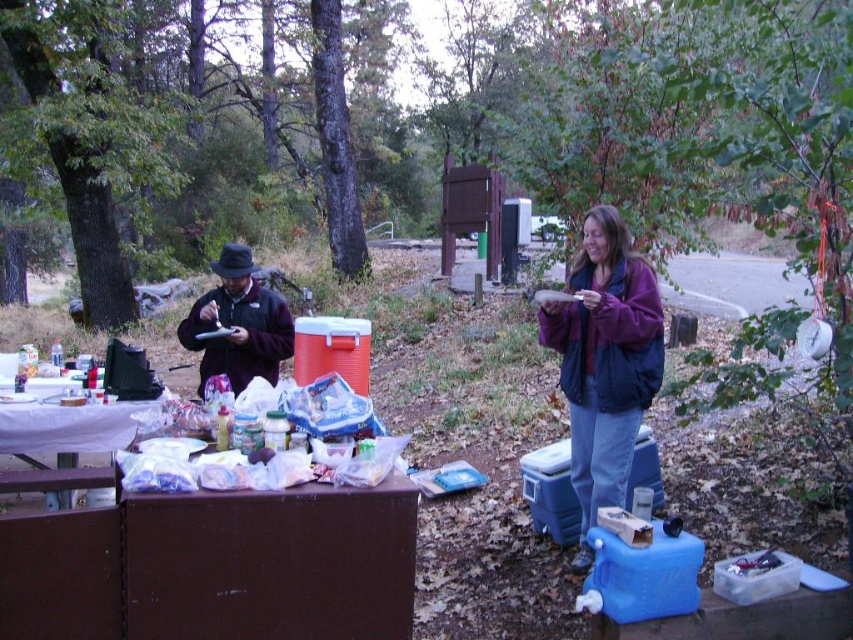
Question: Does purple fleece jacket at upper right come behind matte black jacket at left?

Choices:
 (A) no
 (B) yes

Answer: (A)

Question: Does matte black jacket at left appear under brown wood picnic table at lower left?

Choices:
 (A) no
 (B) yes

Answer: (A)

Question: Which is nearer to the brown wood picnic table at lower left?

Choices:
 (A) purple fleece jacket at upper right
 (B) matte black jacket at left
 (C) translucent plastic bags at center

Answer: (B)

Question: Does purple fleece jacket at upper right lie in front of matte black jacket at left?

Choices:
 (A) yes
 (B) no

Answer: (A)

Question: Which point is closer to the camera?

Choices:
 (A) purple fleece jacket at upper right
 (B) matte black jacket at left
 (C) brown wood picnic table at lower left

Answer: (A)

Question: Estimate the real-world distances between objects in this image. Which object is closer to the matte black jacket at left?

Choices:
 (A) translucent plastic bags at center
 (B) purple fleece jacket at upper right
 (C) brown wood picnic table at lower left

Answer: (C)